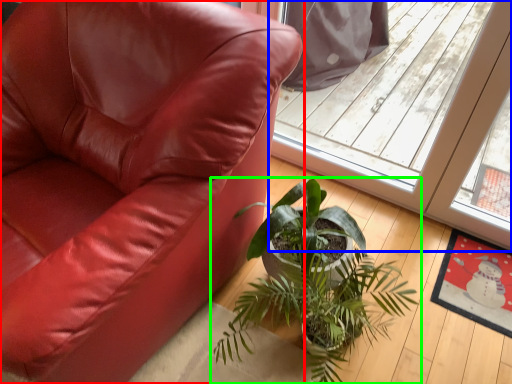
Question: Which is nearer to the chair (highlighted by a red box)? screen door (highlighted by a blue box) or houseplant (highlighted by a green box).

Choices:
 (A) screen door
 (B) houseplant

Answer: (B)